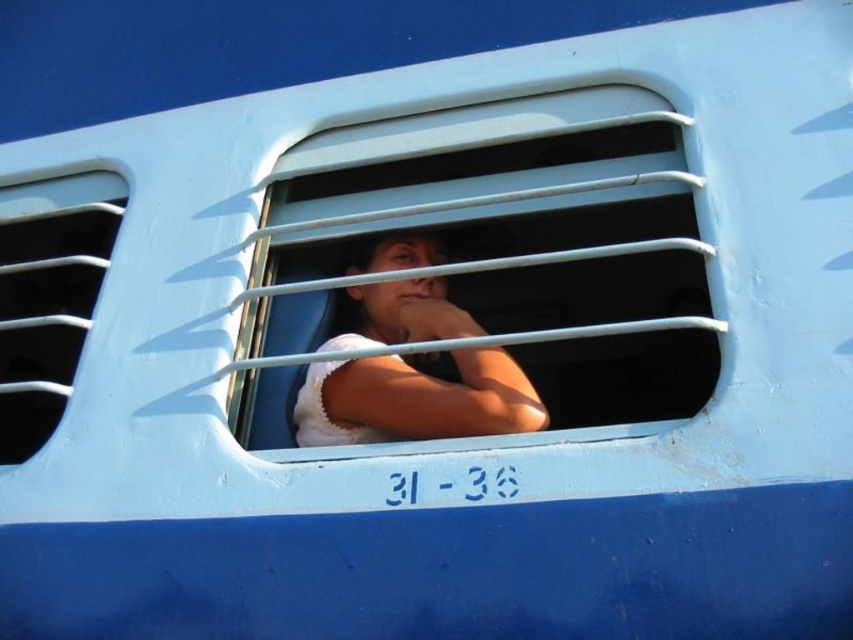
You are a passenger in the vehicle and want to adjust the airflow to your white matte shirt at center. Since the white plastic vent at left is above it, can you direct the airflow downward towards your shirt?

Yes, since the white plastic vent at left is above the white matte shirt at center, you can direct the airflow downward from the vent to reach the shirt.